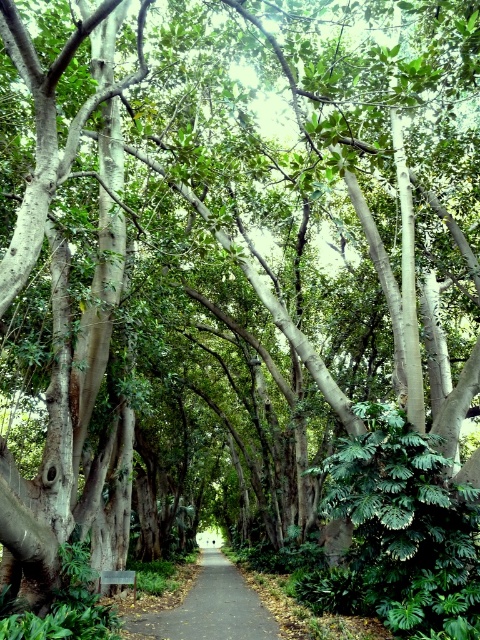
Is point (259, 620) positioned before point (118, 573)?

That is True.

Between point (255, 625) and point (115, 579), which one is positioned in front?

Point (255, 625)

The width and height of the screenshot is (480, 640). I want to click on dark gray asphalt path at center, so click(x=210, y=605).